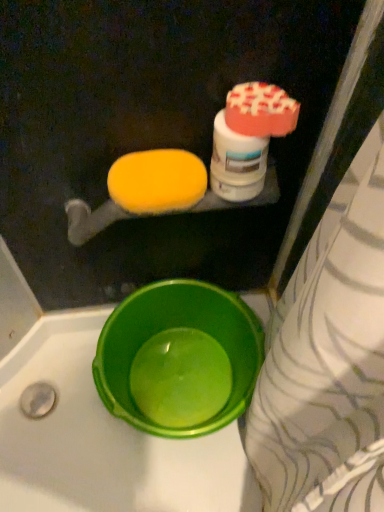
Question: Considering the relative sizes of white glossy bottle at upper right and green plastic basin at lower left in the image provided, is white glossy bottle at upper right bigger than green plastic basin at lower left?

Choices:
 (A) yes
 (B) no

Answer: (B)

Question: Is white glossy bottle at upper right smaller than green plastic basin at lower left?

Choices:
 (A) no
 (B) yes

Answer: (B)

Question: From a real-world perspective, is white glossy bottle at upper right positioned over green plastic basin at lower left based on gravity?

Choices:
 (A) no
 (B) yes

Answer: (B)

Question: From the image's perspective, is white glossy bottle at upper right beneath green plastic basin at lower left?

Choices:
 (A) no
 (B) yes

Answer: (A)

Question: Does white glossy bottle at upper right have a greater height compared to green plastic basin at lower left?

Choices:
 (A) no
 (B) yes

Answer: (A)

Question: Does white glossy bottle at upper right have a lesser height compared to green plastic basin at lower left?

Choices:
 (A) no
 (B) yes

Answer: (B)

Question: Does green plastic basin at lower left appear on the left side of yellow sponge at upper left?

Choices:
 (A) no
 (B) yes

Answer: (A)

Question: Considering the relative sizes of green plastic basin at lower left and yellow sponge at upper left in the image provided, is green plastic basin at lower left shorter than yellow sponge at upper left?

Choices:
 (A) no
 (B) yes

Answer: (A)

Question: Is green plastic basin at lower left taller than yellow sponge at upper left?

Choices:
 (A) no
 (B) yes

Answer: (B)

Question: Can you confirm if green plastic basin at lower left is bigger than yellow sponge at upper left?

Choices:
 (A) no
 (B) yes

Answer: (B)

Question: From a real-world perspective, is green plastic basin at lower left beneath yellow sponge at upper left?

Choices:
 (A) yes
 (B) no

Answer: (A)

Question: Does green plastic basin at lower left lie behind yellow sponge at upper left?

Choices:
 (A) yes
 (B) no

Answer: (A)

Question: Is white glossy bottle at upper right wider than yellow sponge at upper left?

Choices:
 (A) no
 (B) yes

Answer: (A)